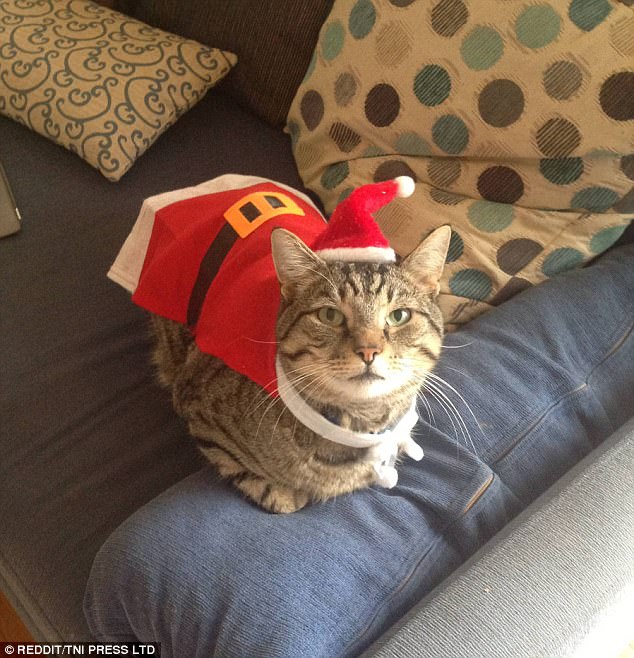
Identify the location of aqua polka dotted pillow. Image resolution: width=634 pixels, height=658 pixels. (501, 104).